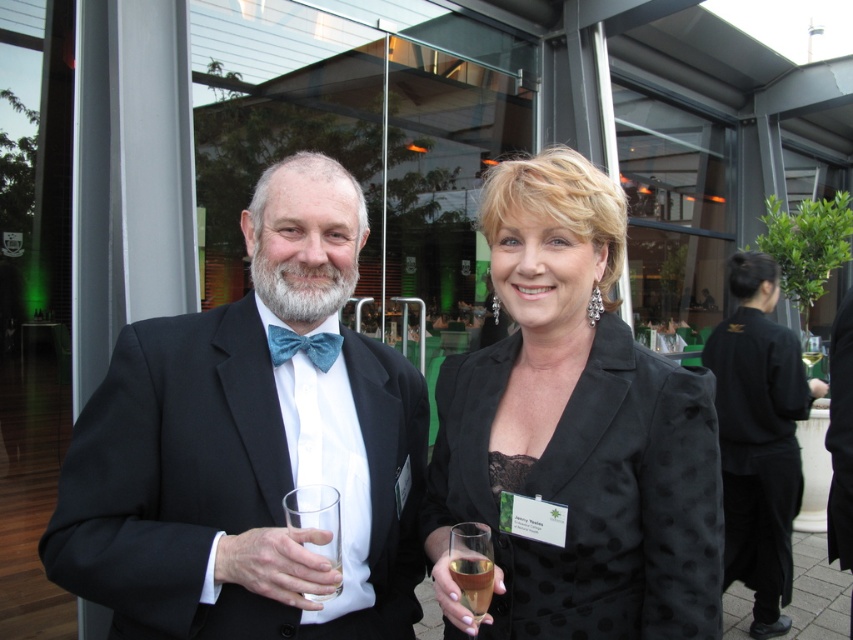
Is translucent glass at lower center to the left of teal satin bow tie at center from the viewer's perspective?

Incorrect, translucent glass at lower center is not on the left side of teal satin bow tie at center.

Which is behind, point (483, 550) or point (288, 342)?

The point (288, 342) is more distant.

The width and height of the screenshot is (853, 640). What do you see at coordinates (473, 566) in the screenshot?
I see `translucent glass at lower center` at bounding box center [473, 566].

Identify the location of translucent glass at lower center. (473, 566).

Who is positioned more to the right, matte black suit at center or clear glass at center?

matte black suit at center is more to the right.

Consider the image. How distant is matte black suit at center from clear glass at center?

The distance of matte black suit at center from clear glass at center is 33.04 centimeters.

Between point (83, 586) and point (299, 528), which one is positioned in front?

Point (299, 528) is in front.

The height and width of the screenshot is (640, 853). Find the location of `matte black suit at center`. matte black suit at center is located at coordinates (242, 449).

Consider the image. Can you confirm if black satin suit at center is wider than black satin business suit at right?

Yes, black satin suit at center is wider than black satin business suit at right.

Who is positioned more to the right, black satin suit at center or black satin business suit at right?

black satin business suit at right

Is point (173, 477) closer to camera compared to point (753, 506)?

Yes, it is in front of point (753, 506).

I want to click on black satin suit at center, so (x=248, y=449).